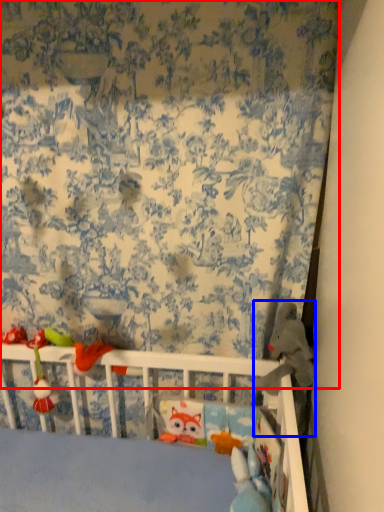
Question: Which point is further to the camera, curtain (highlighted by a red box) or toy (highlighted by a blue box)?

Choices:
 (A) curtain
 (B) toy

Answer: (B)